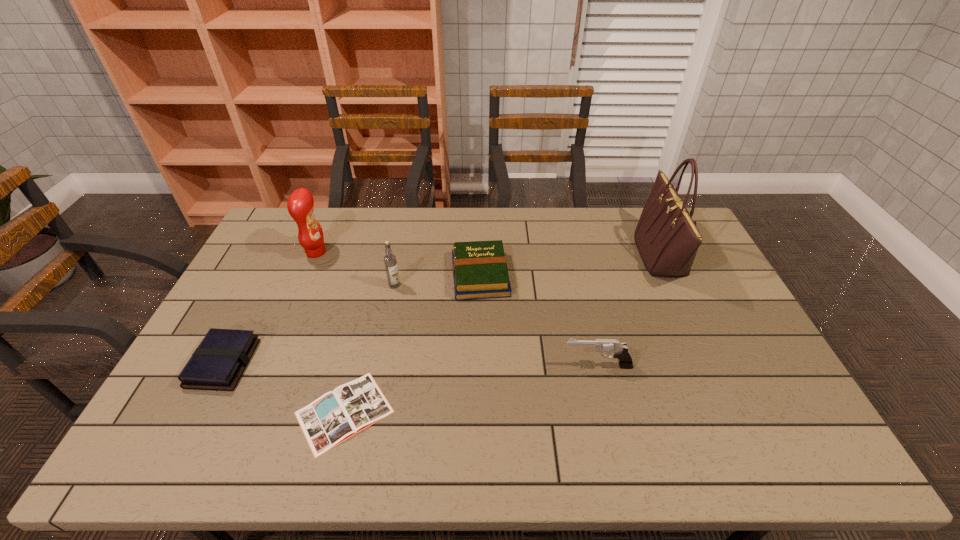
You are a GUI agent. You are given a task and a screenshot of the screen. Output one action in this format:
    pyautogui.click(x=<x>, y=<y>)
    Task: Click on the free space between the fourth shortest object and the fifth shortest object
    Image resolution: width=960 pixels, height=540 pixels.
    Given the screenshot: What is the action you would take?
    pyautogui.click(x=496, y=326)

Where is `vacant region between the leftmost object and the shortest object`? This screenshot has width=960, height=540. vacant region between the leftmost object and the shortest object is located at coordinates (284, 388).

Identify the location of object that is the fifth closest to the vodka. (619, 350).

In order to click on object identified as the fifth closest to the fifth shortest object in this screenshot , I will do `click(619, 350)`.

You are a GUI agent. You are given a task and a screenshot of the screen. Output one action in this format:
    pyautogui.click(x=<x>, y=<y>)
    Task: Click on the book that is the second closest to the rightmost book
    
    Given the screenshot: What is the action you would take?
    pyautogui.click(x=219, y=361)

Select which book is the closest to the sixth object from right to left. Please provide its 2D coordinates. Your answer should be formatted as a tuple, i.e. [(x, y)], where the tuple contains the x and y coordinates of a point satisfying the conditions above.

[(219, 361)]

Where is `vacant space that satisfies the following two spatial constraints: 1. on the label side of the tallest book; 2. on the right side of the condiment`? This screenshot has width=960, height=540. vacant space that satisfies the following two spatial constraints: 1. on the label side of the tallest book; 2. on the right side of the condiment is located at coordinates (306, 275).

At what (x,y) coordinates should I click in order to perform the action: click on vacant region that satisfies the following two spatial constraints: 1. on the front-facing side of the rightmost object; 2. on the label of the vodka. Please return your answer as a coordinate pair (x, y). The height and width of the screenshot is (540, 960). Looking at the image, I should click on (674, 285).

The image size is (960, 540). I want to click on free spot that satisfies the following two spatial constraints: 1. on the label side of the farthest book; 2. on the left side of the condiment, so click(306, 275).